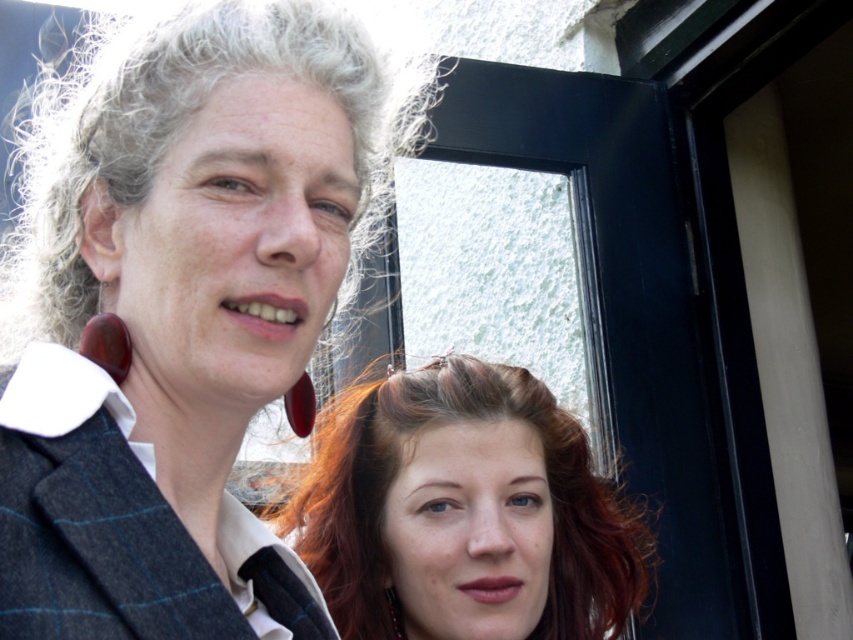
You are a GUI agent. You are given a task and a screenshot of the screen. Output one action in this format:
    pyautogui.click(x=<x>, y=<y>)
    Task: Click on the shiny brown hair at center
    The height and width of the screenshot is (640, 853).
    Given the screenshot: What is the action you would take?
    pyautogui.click(x=463, y=513)

This screenshot has height=640, width=853. Identify the location of shiny brown hair at center. (463, 513).